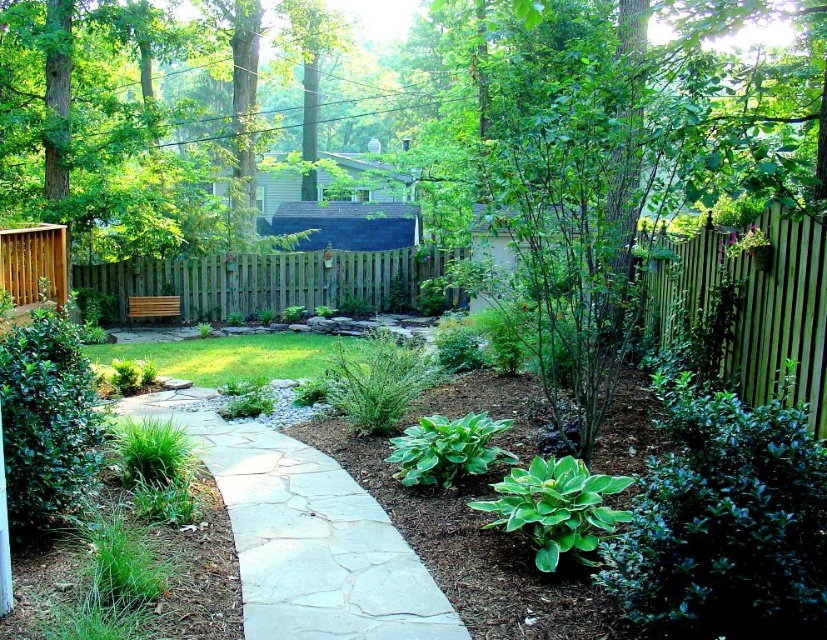
You are standing in the garden and want to walk towards the green wooden fence at right. Which direction should you move relative to the brown wood fence at center?

You should move to the right of the brown wood fence at center to reach the green wooden fence at right.